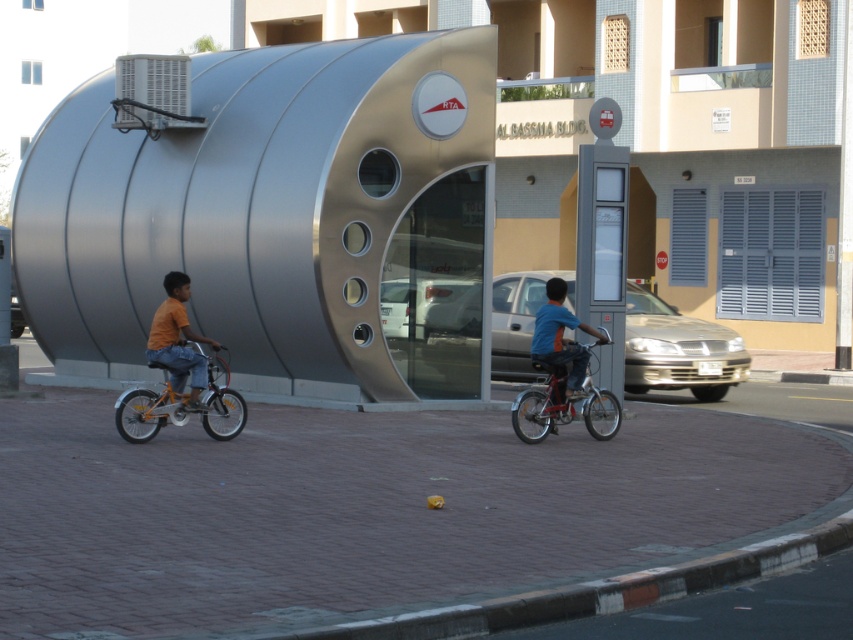
You are a delivery person who needs to deliver a package to the RTA building. You see an orange metallic bicycle at left and a blue fabric shirt at center in the scene. Which object is closer to the RTA building?

The orange metallic bicycle at left is to the left of blue fabric shirt at center, so the blue fabric shirt at center is closer to the RTA building since it is positioned further right than the orange metallic bicycle at left.

You are a photographer trying to capture both the orange cotton shirt at left and the blue fabric shirt at center in a single shot. Which shirt should you focus on first to ensure both are in clear focus?

You should focus on the orange cotton shirt at left first since it is closer to the viewer, ensuring both shirts will be in focus when using a proper depth of field.

You are a delivery person who needs to quickly deliver a package to the RTA building. You see a metallic red bicycle at center and a blue fabric shirt at center in your path. Which object should you move around to reach the RTA building faster?

The metallic red bicycle at center is in front of the blue fabric shirt at center, so you should move around the metallic red bicycle at center to reach the RTA building faster since it is closer to your path.